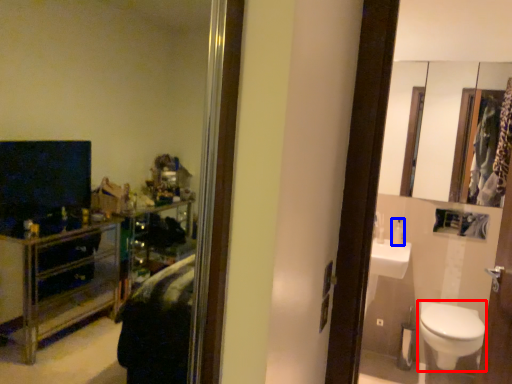
Question: Which object is further to the camera taking this photo, toilet (highlighted by a red box) or toiletry (highlighted by a blue box)?

Choices:
 (A) toilet
 (B) toiletry

Answer: (B)